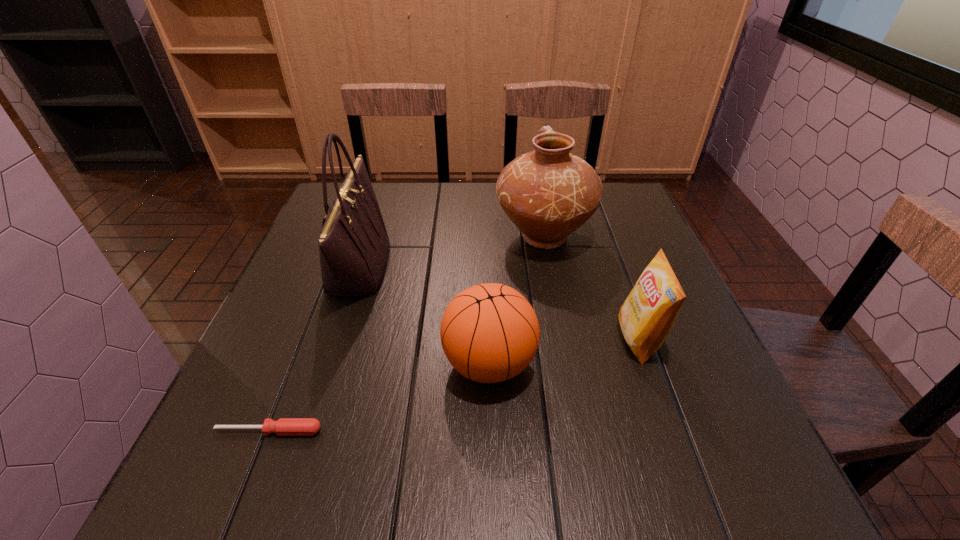
The height and width of the screenshot is (540, 960). What are the coordinates of `vacant area that lies between the screwdriver and the pottery` in the screenshot? It's located at (406, 334).

Where is `vacant space in between the second tallest object and the crisp (potato chip)`? The height and width of the screenshot is (540, 960). vacant space in between the second tallest object and the crisp (potato chip) is located at coordinates (591, 288).

The image size is (960, 540). Identify the location of vacant area that lies between the nearest object and the pottery. tap(406, 334).

Find the location of a particular element. vacant area between the fourth shortest object and the tallest object is located at coordinates (451, 252).

This screenshot has height=540, width=960. In order to click on free space between the screwdriver and the basketball in this screenshot , I will do `click(379, 397)`.

In order to click on empty space that is in between the pottery and the nearest object in this screenshot , I will do `click(406, 334)`.

I want to click on object that stands as the fourth closest to the pottery, so click(284, 426).

Identify which object is located as the second nearest to the handbag. Please provide its 2D coordinates. Your answer should be formatted as a tuple, i.e. [(x, y)], where the tuple contains the x and y coordinates of a point satisfying the conditions above.

[(284, 426)]

You are a GUI agent. You are given a task and a screenshot of the screen. Output one action in this format:
    pyautogui.click(x=<x>, y=<y>)
    Task: Click on the free location that satisfies the following two spatial constraints: 1. on the front-facing side of the crisp (potato chip); 2. on the front side of the shortest object
    
    Given the screenshot: What is the action you would take?
    pyautogui.click(x=671, y=431)

Identify the location of free location that satisfies the following two spatial constraints: 1. on the front-facing side of the handbag; 2. on the back side of the basketball. The image size is (960, 540). (327, 363).